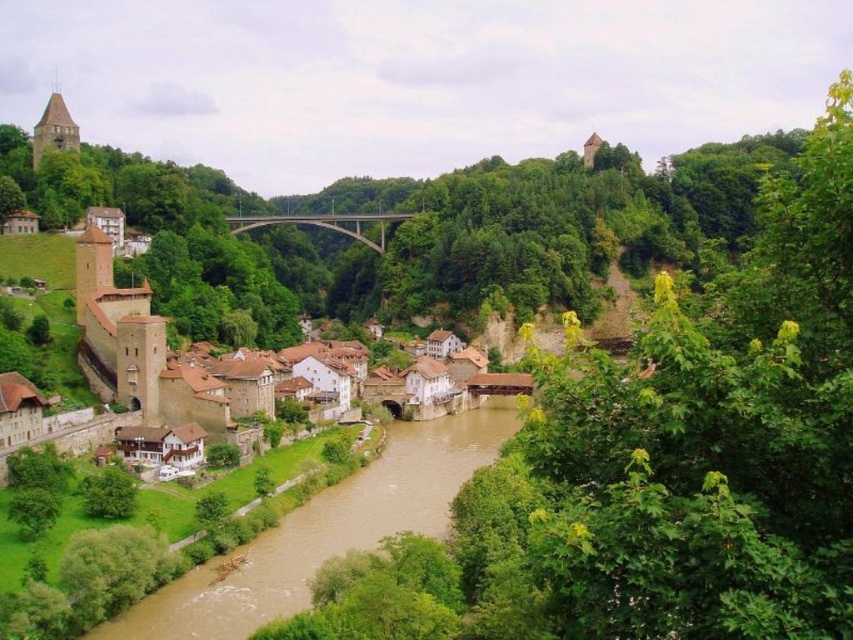
Question: Which point is farther to the camera?

Choices:
 (A) (340, 225)
 (B) (236, 612)

Answer: (A)

Question: Can you confirm if brown muddy water at lower center is positioned below concrete bridge at center?

Choices:
 (A) yes
 (B) no

Answer: (A)

Question: Does brown muddy water at lower center have a lesser width compared to concrete bridge at center?

Choices:
 (A) no
 (B) yes

Answer: (B)

Question: Can you confirm if brown muddy water at lower center is positioned to the right of concrete bridge at center?

Choices:
 (A) no
 (B) yes

Answer: (B)

Question: Which of the following is the farthest from the observer?

Choices:
 (A) 349,547
 (B) 363,228

Answer: (B)